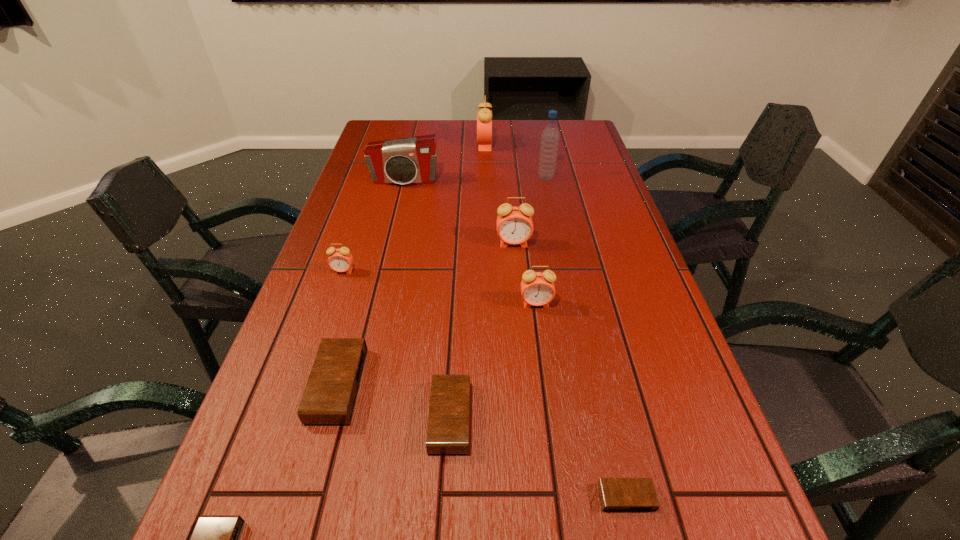
Find the location of a particular element. free space at the far edge is located at coordinates (494, 121).

The image size is (960, 540). I want to click on vacant area at the left edge of the desktop, so click(x=290, y=354).

Identify the location of free space at the right edge of the desktop. (581, 178).

Identify the location of vacant space at the far left corner. Image resolution: width=960 pixels, height=540 pixels. (402, 119).

What are the coordinates of `vacant point located between the biggest pink alarm clock and the seventh tallest object` in the screenshot? It's located at (411, 265).

Find the location of a particular element. This screenshot has height=540, width=960. free spot between the shortest alarm clock and the leftmost pink alarm clock is located at coordinates (485, 384).

Identify the location of vacant space that is in between the biggest black alarm clock and the second tallest alarm clock. The height and width of the screenshot is (540, 960). (425, 314).

Where is `vacant area between the fourth alarm clock from left to right and the shortest alarm clock`? vacant area between the fourth alarm clock from left to right and the shortest alarm clock is located at coordinates (539, 457).

Locate an element on the screen. vacant point located between the water bottle and the fourth shortest object is located at coordinates (442, 281).

Identify which object is the seventh nearest to the second biggest pink alarm clock. Please provide its 2D coordinates. Your answer should be formatted as a tuple, i.e. [(x, y)], where the tuple contains the x and y coordinates of a point satisfying the conditions above.

[(484, 116)]